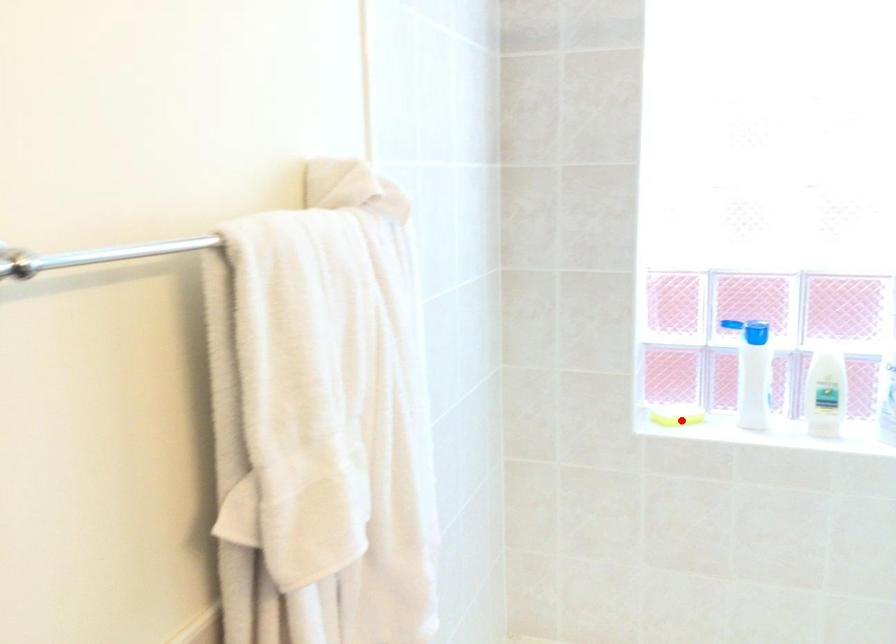
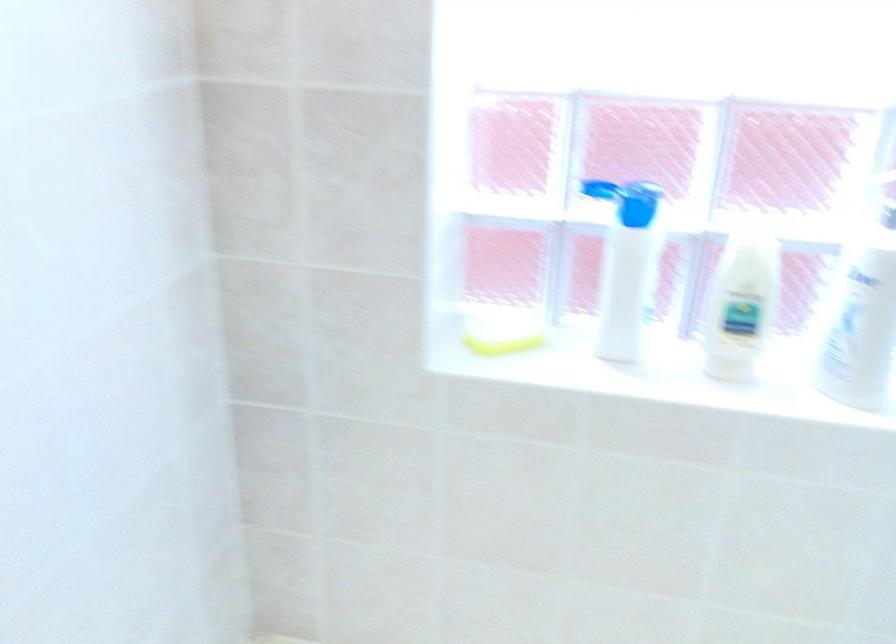
Question: I am providing you with two images of the same scene from different viewpoints. In image1, a red point is highlighted. Considering the same 3D point in image2, which of the following is correct?

Choices:
 (A) It is closer
 (B) It is farther

Answer: (A)